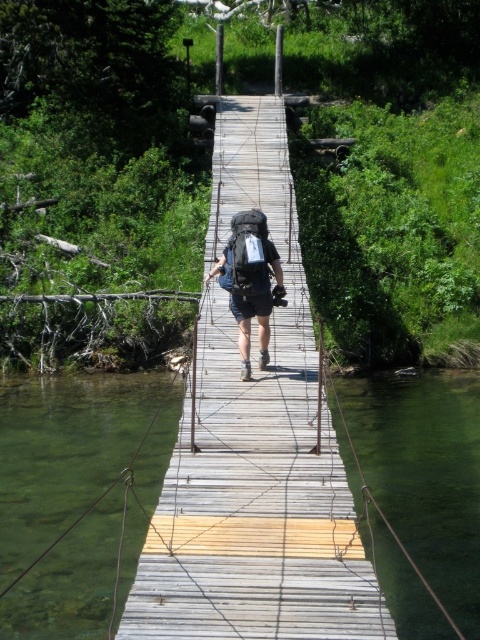
You are standing on the wooden bridge at center. What is the 2D coordinate of your current position?

The 2D coordinate of the wooden bridge at center is at point (253, 451).

You are a hiker planning to cross the wooden bridge at center while carrying your matte black backpack at center. Based on their sizes, will the bridge be able to support your backpack?

The wooden bridge at center has a larger size compared to matte black backpack at center, so it should be able to support the weight of the backpack as long as it is within the bridge design limits.